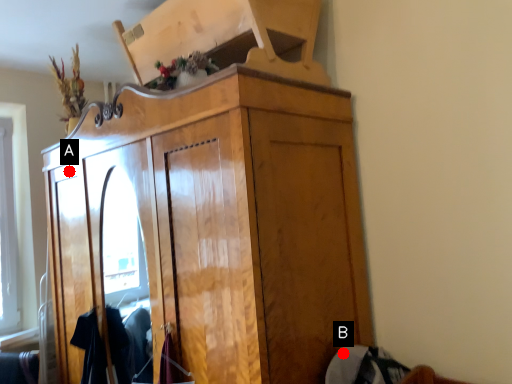
Question: Two points are circled on the image, labeled by A and B beside each circle. Which point is further to the camera?

Choices:
 (A) A is further
 (B) B is further

Answer: (A)